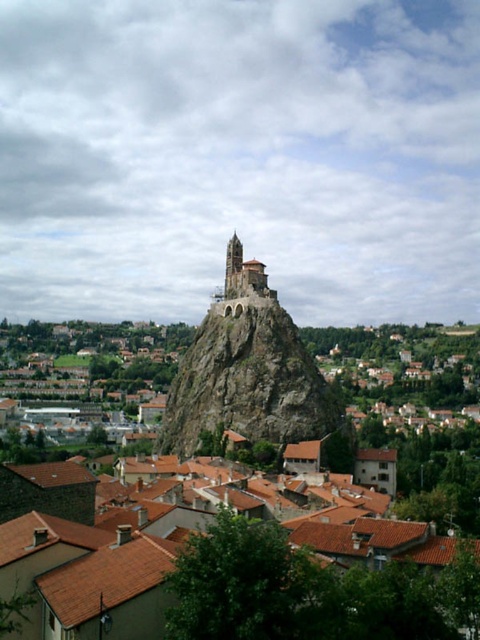
Question: Does rocky cliff at center come behind smooth stone tower at center?

Choices:
 (A) no
 (B) yes

Answer: (A)

Question: Based on their relative distances, which object is farther from the rocky cliff at center?

Choices:
 (A) smooth stone tower at center
 (B) brown tiled roofs at center

Answer: (B)

Question: Does brown tiled roofs at center appear under rocky cliff at center?

Choices:
 (A) no
 (B) yes

Answer: (B)

Question: Which point is closer to the camera?

Choices:
 (A) (219, 337)
 (B) (392, 531)

Answer: (B)

Question: Can you confirm if rocky cliff at center is positioned to the right of smooth stone tower at center?

Choices:
 (A) yes
 (B) no

Answer: (A)

Question: Which point is closer to the camera taking this photo?

Choices:
 (A) (344, 554)
 (B) (228, 272)
 (C) (276, 307)

Answer: (A)